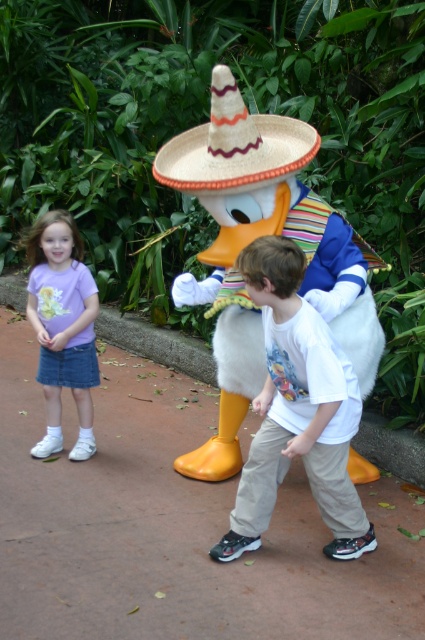
Can you confirm if white cotton shirt at center is positioned to the right of straw sombrero at center?

Indeed, white cotton shirt at center is positioned on the right side of straw sombrero at center.

Does white cotton shirt at center have a smaller size compared to straw sombrero at center?

Incorrect, white cotton shirt at center is not smaller in size than straw sombrero at center.

You are a GUI agent. You are given a task and a screenshot of the screen. Output one action in this format:
    pyautogui.click(x=<x>, y=<y>)
    Task: Click on the white cotton shirt at center
    
    Given the screenshot: What is the action you would take?
    click(x=297, y=410)

Identify the location of white cotton shirt at center. (297, 410).

Is white plush duck at center positioned at the back of straw sombrero at center?

Yes.

Does white plush duck at center appear under straw sombrero at center?

Yes, white plush duck at center is below straw sombrero at center.

Describe the element at coordinates (251, 241) in the screenshot. The image size is (425, 640). I see `white plush duck at center` at that location.

Locate an element on the screen. The height and width of the screenshot is (640, 425). white plush duck at center is located at coordinates (251, 241).

Is white cotton shirt at center positioned in front of purple cotton shirt at left?

Yes, it is in front of purple cotton shirt at left.

Does point (308, 356) come in front of point (88, 436)?

Yes, it is in front of point (88, 436).

I want to click on white cotton shirt at center, so click(x=297, y=410).